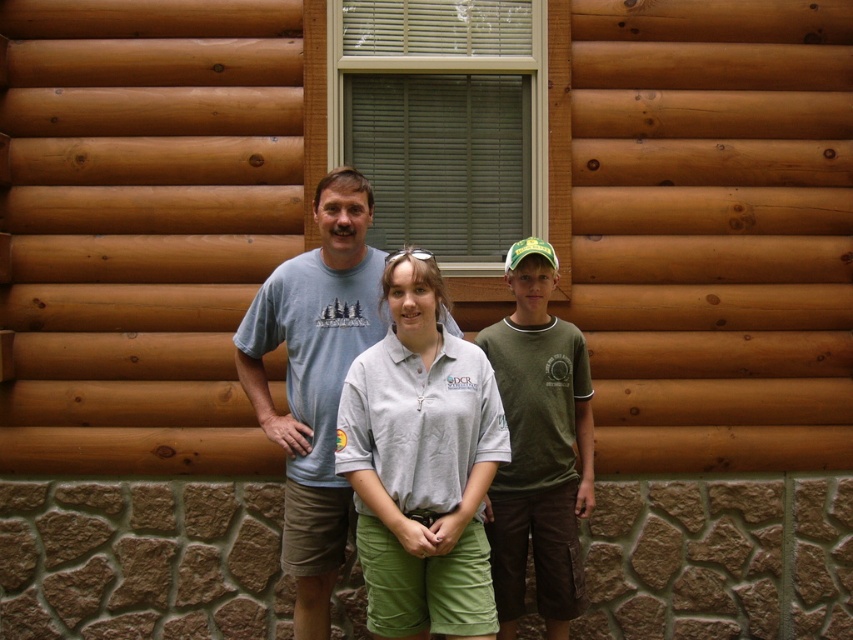
You are a photographer trying to capture a clear photo of the gray cotton shirt at center and the green cotton shirt at center. Which one will be more visible in the photo?

The gray cotton shirt at center will be more visible in the photo because it is positioned in front of the green cotton shirt at center.